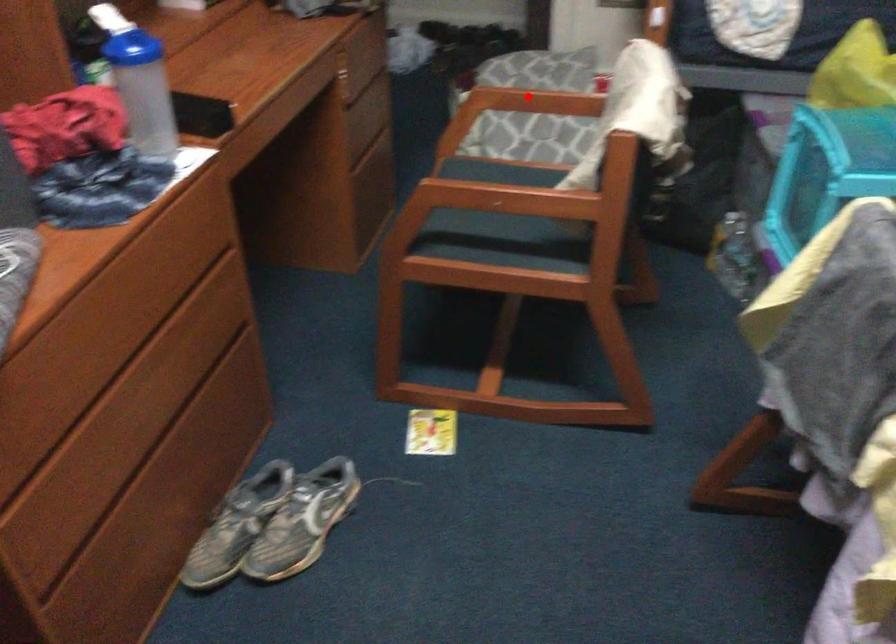
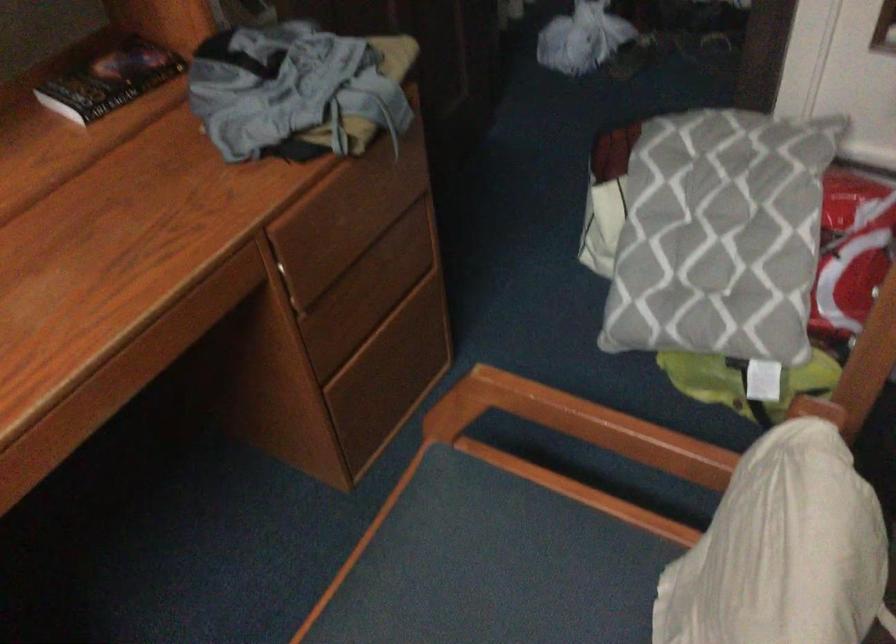
Question: I am providing you with two images of the same scene from different viewpoints. A red point is marked on the first image. Is the red point's position out of view in image 2?

Choices:
 (A) Yes
 (B) No

Answer: (B)